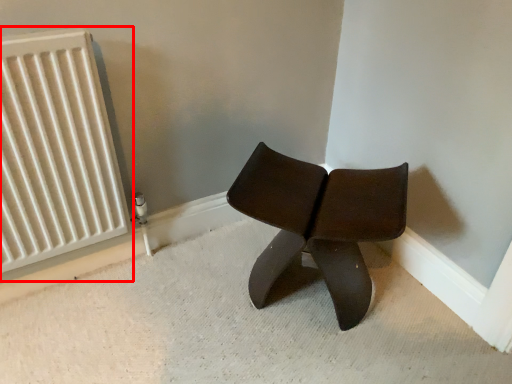
Question: In this image, where is radiator (annotated by the red box) located relative to chair?

Choices:
 (A) right
 (B) left

Answer: (B)